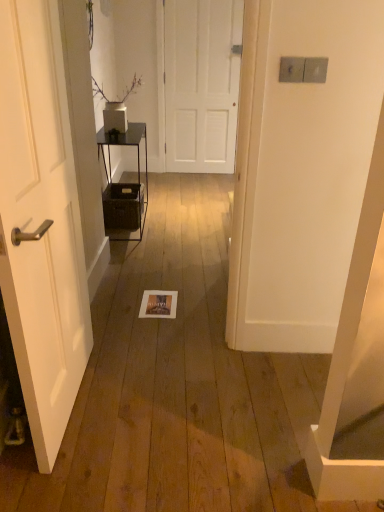
Question: Looking at their shapes, would you say white matte door at center, the 1th door from the top, is wider or thinner than metallic black shelf at center?

Choices:
 (A) wide
 (B) thin

Answer: (B)

Question: Would you say white matte door at center, the 1th door from the top, is inside or outside metallic black shelf at center?

Choices:
 (A) outside
 (B) inside

Answer: (A)

Question: Which is nearer to the white matte door at left, the first door in the bottom-to-top sequence?

Choices:
 (A) metallic black shelf at center
 (B) white matte door at center, which appears as the first door when viewed from the right

Answer: (A)

Question: Which is nearer to the metallic black shelf at center?

Choices:
 (A) white matte door at center, which is the 2th door from left to right
 (B) white matte door at left, the 1th door in the left-to-right sequence

Answer: (B)